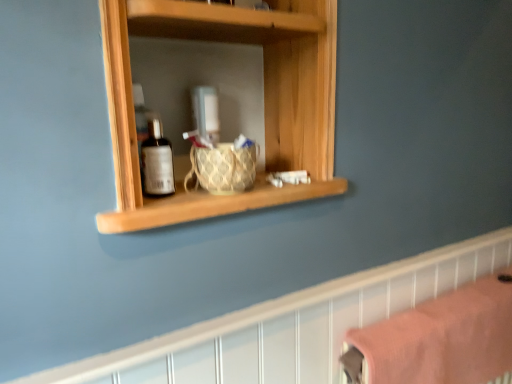
Describe the element at coordinates (440, 339) in the screenshot. I see `pink fabric towel at lower right` at that location.

This screenshot has width=512, height=384. What do you see at coordinates (290, 325) in the screenshot? I see `wooden shelf at upper center` at bounding box center [290, 325].

This screenshot has width=512, height=384. I want to click on wooden shelf at center, so [264, 101].

Where is `woven fabric basket at center`? This screenshot has height=384, width=512. woven fabric basket at center is located at coordinates (223, 168).

Can you confirm if pink fabric towel at lower right is shorter than wooden shelf at upper center?

Yes, pink fabric towel at lower right is shorter than wooden shelf at upper center.

Is pink fabric towel at lower right beside wooden shelf at upper center?

No.

Considering the relative sizes of pink fabric towel at lower right and wooden shelf at upper center in the image provided, is pink fabric towel at lower right thinner than wooden shelf at upper center?

No, pink fabric towel at lower right is not thinner than wooden shelf at upper center.

From the image's perspective, who appears lower, pink fabric towel at lower right or wooden shelf at upper center?

pink fabric towel at lower right is shown below in the image.

Is wooden shelf at upper center not near woven fabric basket at center?

No, wooden shelf at upper center is in close proximity to woven fabric basket at center.

Is wooden shelf at upper center positioned beyond the bounds of woven fabric basket at center?

Indeed, wooden shelf at upper center is completely outside woven fabric basket at center.

The width and height of the screenshot is (512, 384). I want to click on ledge below the woven fabric basket at center (from the image's perspective), so click(x=290, y=325).

From the picture: Is wooden shelf at upper center at the left side of woven fabric basket at center?

No.

From a real-world perspective, is pink fabric towel at lower right on wooden shelf at center?

Incorrect, from a real-world perspective, pink fabric towel at lower right is lower than wooden shelf at center.

From the image's perspective, is pink fabric towel at lower right located above or below wooden shelf at center?

pink fabric towel at lower right is situated lower than wooden shelf at center in the image.

Find the location of a particular element. shelf lying above the pink fabric towel at lower right (from the image's perspective) is located at coordinates (264, 101).

Is wooden shelf at center at the back of pink fabric towel at lower right?

No.

Between pink fabric towel at lower right and woven fabric basket at center, which one is positioned behind?

pink fabric towel at lower right is more distant.

Consider the image. From the image's perspective, which is above, pink fabric towel at lower right or woven fabric basket at center?

From the image's view, woven fabric basket at center is above.

Can woven fabric basket at center be found inside pink fabric towel at lower right?

Definitely not — woven fabric basket at center is not inside pink fabric towel at lower right.

Is wooden shelf at upper center positioned beyond the bounds of pink fabric towel at lower right?

Absolutely, wooden shelf at upper center is external to pink fabric towel at lower right.

In the scene shown: Is wooden shelf at upper center oriented towards pink fabric towel at lower right?

Yes, wooden shelf at upper center is facing pink fabric towel at lower right.

Find the location of a particular element. bath towel to the right of wooden shelf at upper center is located at coordinates (440, 339).

Can you confirm if woven fabric basket at center is smaller than pink fabric towel at lower right?

Yes, woven fabric basket at center is smaller than pink fabric towel at lower right.

Looking at this image, which is more to the right, woven fabric basket at center or pink fabric towel at lower right?

pink fabric towel at lower right.

From a real-world perspective, between woven fabric basket at center and pink fabric towel at lower right, who is vertically higher?

woven fabric basket at center.

Is point (146, 351) farther from viewer compared to point (190, 202)?

No, it is not.

Is wooden shelf at upper center positioned beyond the bounds of wooden shelf at center?

wooden shelf at upper center is positioned outside wooden shelf at center.

Consider the image. Which object is positioned more to the right, wooden shelf at upper center or wooden shelf at center?

wooden shelf at upper center is more to the right.

From a real-world perspective, relative to wooden shelf at center, is wooden shelf at upper center vertically above or below?

wooden shelf at upper center is situated lower than wooden shelf at center in the real world.

The height and width of the screenshot is (384, 512). I want to click on bath towel that appears below the wooden shelf at upper center (from a real-world perspective), so click(440, 339).

At what (x,y) coordinates should I click in order to perform the action: click on basket above the wooden shelf at upper center (from a real-world perspective). Please return your answer as a coordinate pair (x, y). Looking at the image, I should click on (223, 168).

Looking at this image, which object lies nearer to the anchor point woven fabric basket at center, wooden shelf at upper center or pink fabric towel at lower right?

The object closer to woven fabric basket at center is wooden shelf at upper center.

Looking at this image, from the image, which object appears to be nearer to woven fabric basket at center, pink fabric towel at lower right or wooden shelf at center?

Based on the image, wooden shelf at center appears to be nearer to woven fabric basket at center.

Estimate the real-world distances between objects in this image. Which object is closer to pink fabric towel at lower right, wooden shelf at upper center or woven fabric basket at center?

Based on the image, wooden shelf at upper center appears to be nearer to pink fabric towel at lower right.

Which object lies nearer to the anchor point wooden shelf at upper center, wooden shelf at center or pink fabric towel at lower right?

pink fabric towel at lower right.

Estimate the real-world distances between objects in this image. Which object is closer to wooden shelf at center, woven fabric basket at center or pink fabric towel at lower right?

woven fabric basket at center is closer to wooden shelf at center.

When comparing their distances from wooden shelf at upper center, does woven fabric basket at center or wooden shelf at center seem further?

wooden shelf at center is positioned further to the anchor wooden shelf at upper center.

Consider the image. Considering their positions, is wooden shelf at upper center positioned further to pink fabric towel at lower right than wooden shelf at center?

wooden shelf at center is positioned further to the anchor pink fabric towel at lower right.

Estimate the real-world distances between objects in this image. Which object is further from wooden shelf at upper center, wooden shelf at center or woven fabric basket at center?

wooden shelf at center is further to wooden shelf at upper center.

What are the coordinates of `ledge between wooden shelf at center and pink fabric towel at lower right from top to bottom` in the screenshot? It's located at (290, 325).

Image resolution: width=512 pixels, height=384 pixels. I want to click on basket between wooden shelf at center and wooden shelf at upper center from top to bottom, so click(223, 168).

Where is `basket between wooden shelf at center and pink fabric towel at lower right in the horizontal direction`? The image size is (512, 384). basket between wooden shelf at center and pink fabric towel at lower right in the horizontal direction is located at coordinates (223, 168).

You are a GUI agent. You are given a task and a screenshot of the screen. Output one action in this format:
    pyautogui.click(x=<x>, y=<y>)
    Task: Click on the ledge between woven fabric basket at center and pink fabric towel at lower right in the horizontal direction
    The image size is (512, 384).
    Given the screenshot: What is the action you would take?
    pyautogui.click(x=290, y=325)